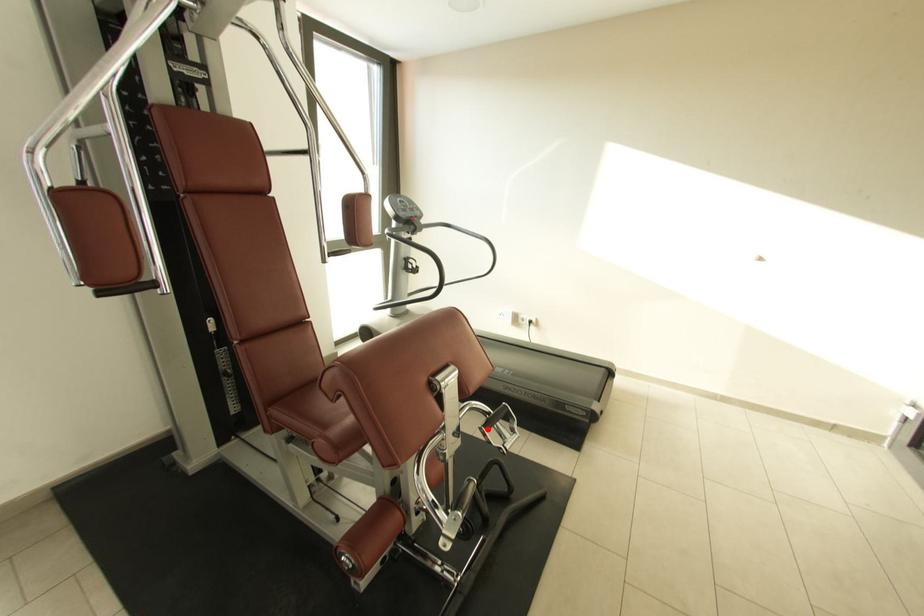
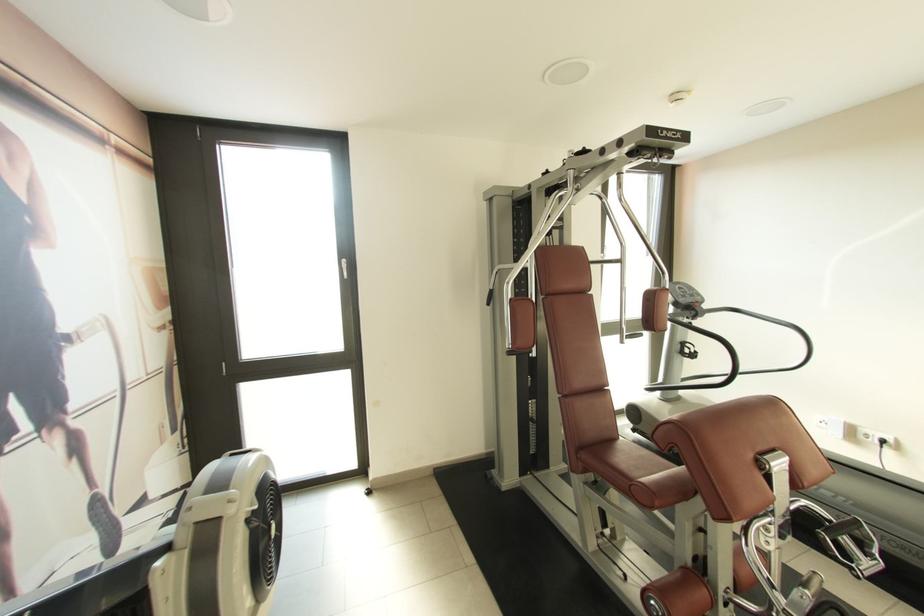
Find the pixel in the second image that matches the highlighted location in the first image.

(829, 535)